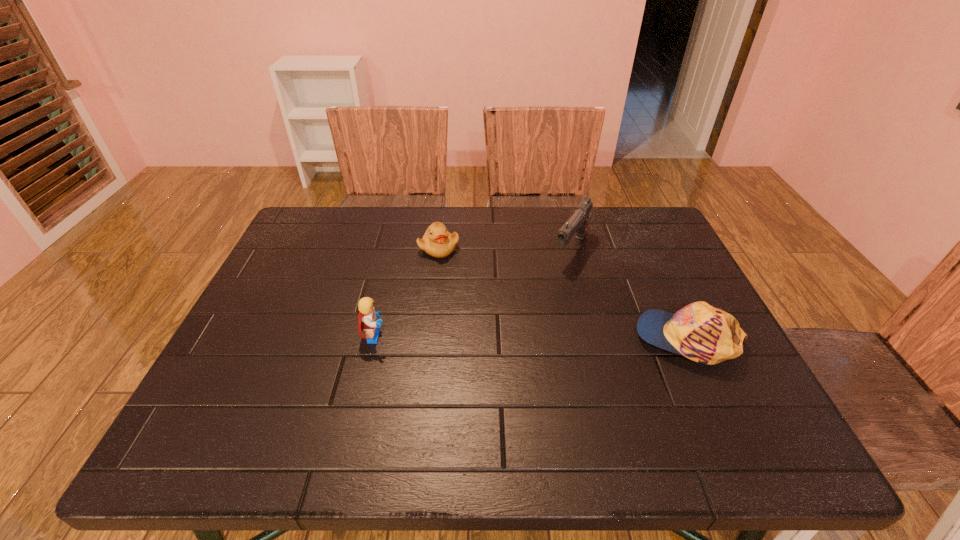
Locate an element on the screen. free space at the right edge of the desktop is located at coordinates (675, 308).

I want to click on vacant space at the far left corner of the desktop, so click(x=342, y=228).

In the image, there is a desktop. What are the coordinates of `vacant space at the near left corner` in the screenshot? It's located at (223, 408).

This screenshot has width=960, height=540. I want to click on vacant region at the far right corner of the desktop, so click(621, 226).

This screenshot has height=540, width=960. Find the location of `free spot between the rightmost object and the leftmost object`. free spot between the rightmost object and the leftmost object is located at coordinates (532, 338).

Identify the location of free space between the leftmost object and the third object from right to left. (407, 292).

I want to click on vacant space that is in between the third object from left to right and the duckling, so click(x=505, y=248).

What are the coordinates of `vacant area that lies between the duckling and the third object from left to right` in the screenshot? It's located at (505, 248).

Find the location of a particular element. The image size is (960, 540). free space between the third object from right to left and the leftmost object is located at coordinates (407, 292).

This screenshot has height=540, width=960. Find the location of `empty space between the third object from right to left and the gun`. empty space between the third object from right to left and the gun is located at coordinates (505, 248).